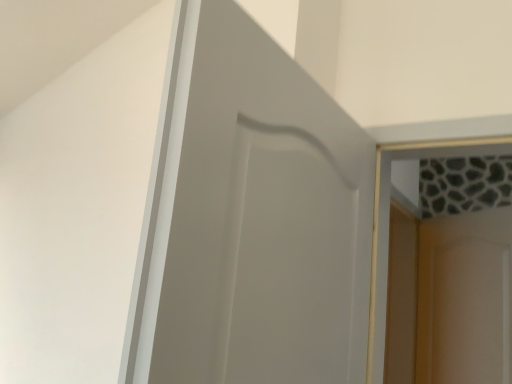
Where is `white glossy screen door at upper right`? The image size is (512, 384). white glossy screen door at upper right is located at coordinates (465, 299).

This screenshot has width=512, height=384. What do you see at coordinates (465, 299) in the screenshot? I see `white glossy screen door at upper right` at bounding box center [465, 299].

In order to face white glossy screen door at upper right, should I rotate leftwards or rightwards?

You should look right and rotate roughly 25.409 degrees.

Describe the element at coordinates (251, 218) in the screenshot. Image resolution: width=512 pixels, height=384 pixels. I see `matte white door at center` at that location.

Where is `matte white door at center`? matte white door at center is located at coordinates (251, 218).

Where is `white glossy screen door at upper right`? Image resolution: width=512 pixels, height=384 pixels. white glossy screen door at upper right is located at coordinates tap(465, 299).

In the scene shown: In the image, is matte white door at center on the left side or the right side of white glossy screen door at upper right?

In the image, matte white door at center appears on the left side of white glossy screen door at upper right.

Considering the positions of objects matte white door at center and white glossy screen door at upper right in the image provided, who is in front, matte white door at center or white glossy screen door at upper right?

matte white door at center is more forward.

Which is behind, point (358, 325) or point (440, 237)?

The point (440, 237) is farther.

From the image's perspective, is matte white door at center over white glossy screen door at upper right?

Yes, from the image's perspective, matte white door at center is on top of white glossy screen door at upper right.

From a real-world perspective, which is physically above, matte white door at center or white glossy screen door at upper right?

From a 3D spatial view, matte white door at center is above.

Considering the sizes of matte white door at center and white glossy screen door at upper right in the image, is matte white door at center wider or thinner than white glossy screen door at upper right?

matte white door at center is wider than white glossy screen door at upper right.

Does matte white door at center have a greater height compared to white glossy screen door at upper right?

In fact, matte white door at center may be shorter than white glossy screen door at upper right.

Does matte white door at center have a smaller size compared to white glossy screen door at upper right?

Actually, matte white door at center might be larger than white glossy screen door at upper right.

Can white glossy screen door at upper right be found inside matte white door at center?

No.

Can you see matte white door at center touching white glossy screen door at upper right?

matte white door at center and white glossy screen door at upper right are clearly separated.

Is matte white door at center facing away from white glossy screen door at upper right?

No, matte white door at center is not facing the opposite direction of white glossy screen door at upper right.

How many degrees apart are the facing directions of matte white door at center and white glossy screen door at upper right?

The angle between the facing direction of matte white door at center and the facing direction of white glossy screen door at upper right is 126 degrees.

You are a GUI agent. You are given a task and a screenshot of the screen. Output one action in this format:
    pyautogui.click(x=<x>, y=<y>)
    Task: Click on the screen door located behind the matte white door at center
    The image size is (512, 384).
    Given the screenshot: What is the action you would take?
    pyautogui.click(x=465, y=299)

Based on the photo, is white glossy screen door at upper right to the right of matte white door at center from the viewer's perspective?

Indeed, white glossy screen door at upper right is positioned on the right side of matte white door at center.

Is white glossy screen door at upper right further to camera compared to matte white door at center?

Yes, white glossy screen door at upper right is behind matte white door at center.

Which is nearer, (480,238) or (314,310)?

Point (480,238).

From the image's perspective, which object appears higher, white glossy screen door at upper right or matte white door at center?

matte white door at center, from the image's perspective.

From a real-world perspective, is white glossy screen door at upper right located beneath matte white door at center?

Yes.

Based on the photo, considering the sizes of white glossy screen door at upper right and matte white door at center in the image, is white glossy screen door at upper right wider or thinner than matte white door at center?

Considering their sizes, white glossy screen door at upper right looks slimmer than matte white door at center.

Which of these two, white glossy screen door at upper right or matte white door at center, stands shorter?

With less height is matte white door at center.

Considering the sizes of objects white glossy screen door at upper right and matte white door at center in the image provided, who is bigger, white glossy screen door at upper right or matte white door at center?

Bigger between the two is matte white door at center.

Choose the correct answer: Is white glossy screen door at upper right inside matte white door at center or outside it?

white glossy screen door at upper right is not enclosed by matte white door at center.

Would you consider white glossy screen door at upper right to be distant from matte white door at center?

That's right, there is a large distance between white glossy screen door at upper right and matte white door at center.

Could you tell me if white glossy screen door at upper right is facing matte white door at center?

No.

The width and height of the screenshot is (512, 384). Find the location of `door above the white glossy screen door at upper right (from a real-world perspective)`. door above the white glossy screen door at upper right (from a real-world perspective) is located at coordinates (251, 218).

The height and width of the screenshot is (384, 512). I want to click on screen door behind the matte white door at center, so click(465, 299).

You are a GUI agent. You are given a task and a screenshot of the screen. Output one action in this format:
    pyautogui.click(x=<x>, y=<y>)
    Task: Click on the door that appears above the white glossy screen door at upper right (from the image's perspective)
    Image resolution: width=512 pixels, height=384 pixels.
    Given the screenshot: What is the action you would take?
    pyautogui.click(x=251, y=218)